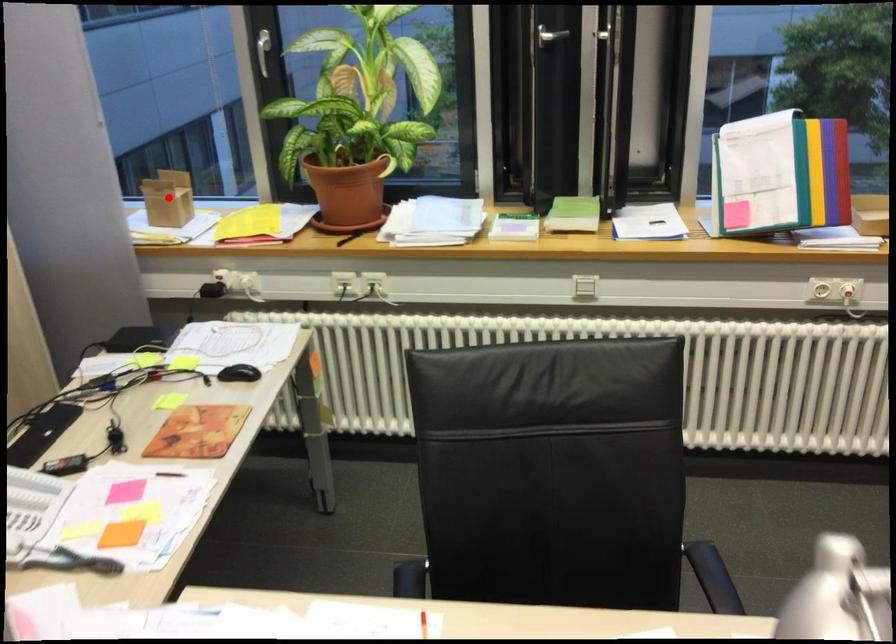
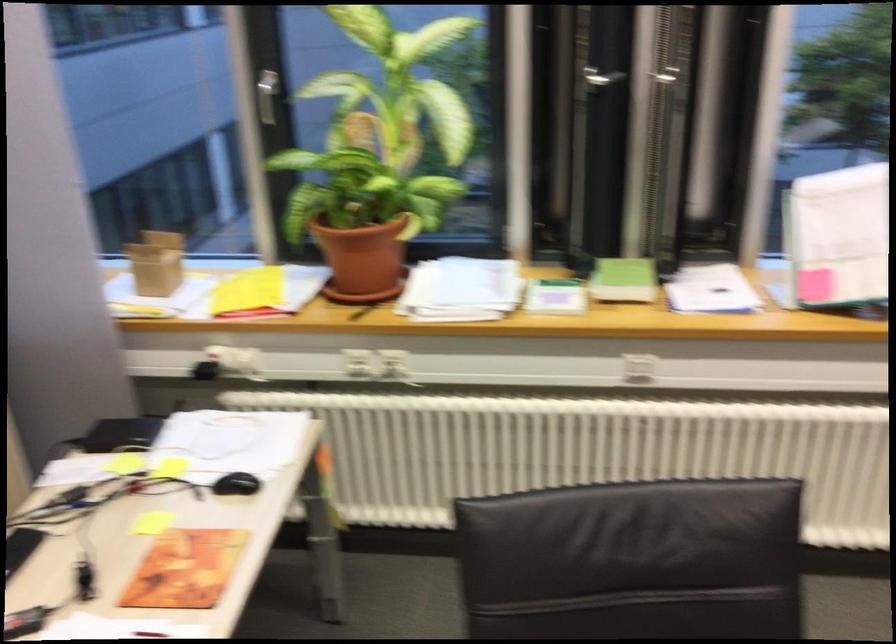
Question: I am providing you with two images of the same scene from different viewpoints. Image1 has a red point marked. In image2, the corresponding 3D location appears at what relative position? Reply with the corresponding letter.

Choices:
 (A) Closer
 (B) Farther

Answer: (A)